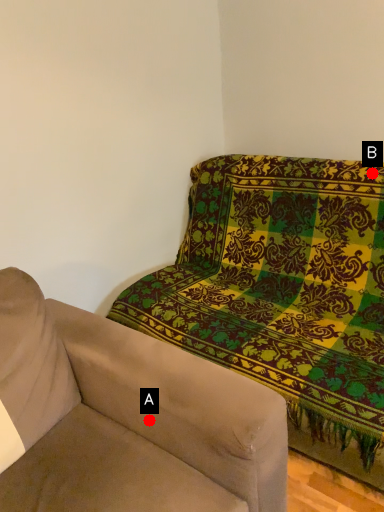
Question: Two points are circled on the image, labeled by A and B beside each circle. Which point appears closest to the camera in this image?

Choices:
 (A) A is closer
 (B) B is closer

Answer: (A)